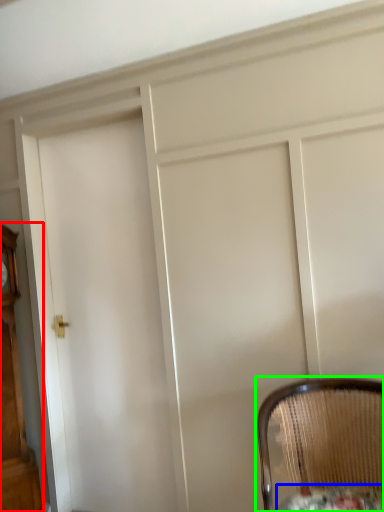
Question: Considering the real-world distances, which object is farthest from furniture (highlighted by a red box)? round table (highlighted by a blue box) or chair (highlighted by a green box)?

Choices:
 (A) round table
 (B) chair

Answer: (A)